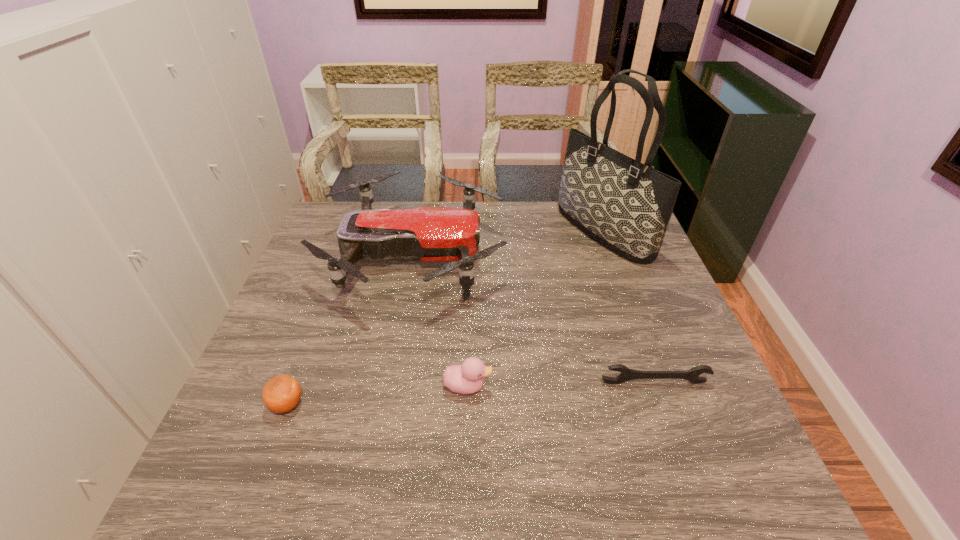
Where is `vacant area that lies between the orange and the duckling`? The height and width of the screenshot is (540, 960). vacant area that lies between the orange and the duckling is located at coordinates (377, 395).

What are the coordinates of `free space between the duckling and the orange` in the screenshot? It's located at (377, 395).

Image resolution: width=960 pixels, height=540 pixels. Find the location of `vacant space that is in between the tallest object and the duckling`. vacant space that is in between the tallest object and the duckling is located at coordinates (536, 309).

Identify which object is the third nearest to the tote bag. Please provide its 2D coordinates. Your answer should be formatted as a tuple, i.e. [(x, y)], where the tuple contains the x and y coordinates of a point satisfying the conditions above.

[(467, 378)]

Identify which object is located as the fourth nearest to the duckling. Please provide its 2D coordinates. Your answer should be formatted as a tuple, i.e. [(x, y)], where the tuple contains the x and y coordinates of a point satisfying the conditions above.

[(625, 205)]